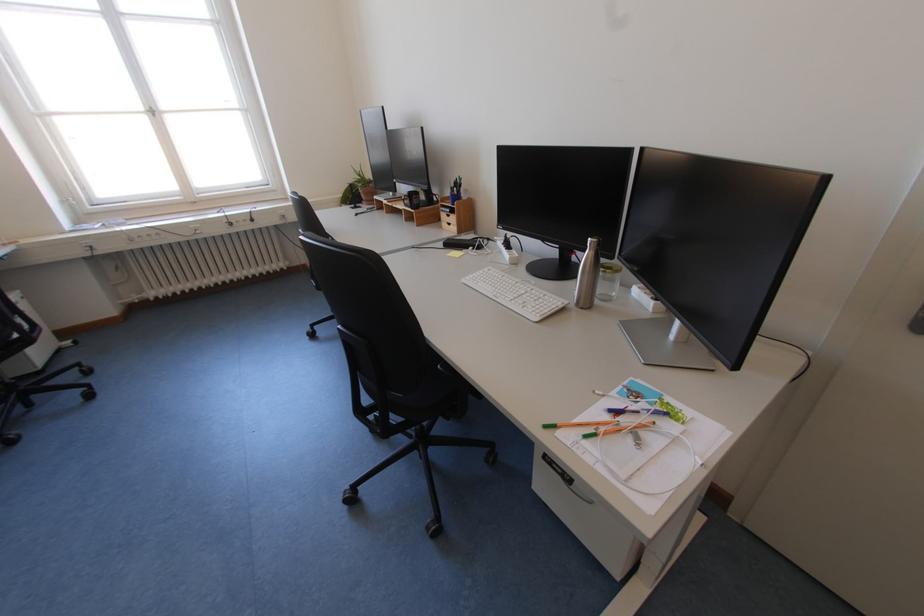
This screenshot has width=924, height=616. Identify the location of wooden drawer pull. pos(565,487).